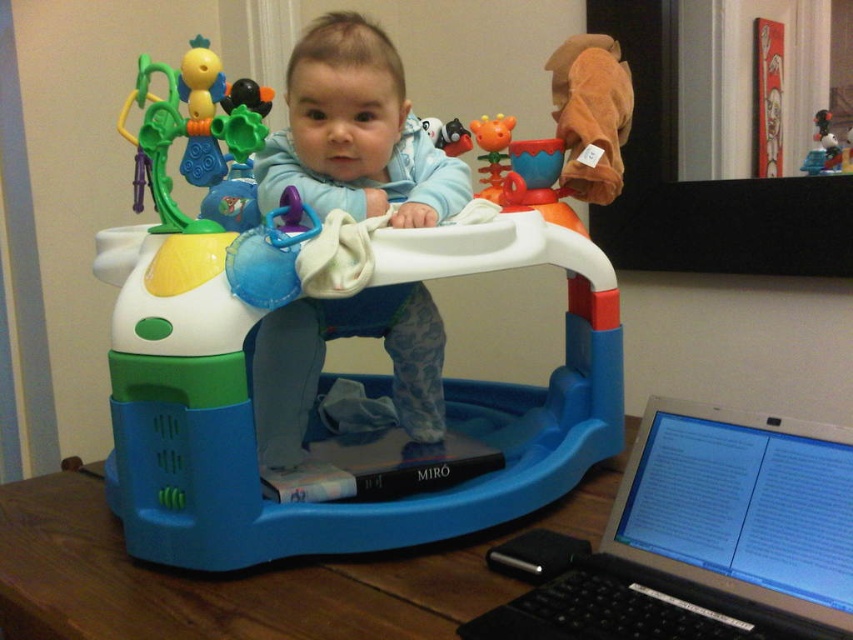
Question: Observing the image, what is the correct spatial positioning of silver metallic laptop at lower right in reference to blue soft walker at center?

Choices:
 (A) left
 (B) right

Answer: (B)

Question: Which point is closer to the camera?

Choices:
 (A) (824, 129)
 (B) (392, 243)
 (C) (663, 397)
 (D) (373, 29)

Answer: (B)

Question: Among these points, which one is nearest to the camera?

Choices:
 (A) (805, 172)
 (B) (413, 515)
 (C) (306, 109)

Answer: (B)

Question: Does blue plastic walker at center appear on the right side of silver metallic laptop at lower right?

Choices:
 (A) yes
 (B) no

Answer: (B)

Question: Is blue soft walker at center above matte plastic toy at upper right?

Choices:
 (A) yes
 (B) no

Answer: (B)

Question: Which point is farther to the camera?

Choices:
 (A) blue plastic walker at center
 (B) blue soft walker at center
 (C) matte plastic toy at upper right

Answer: (C)